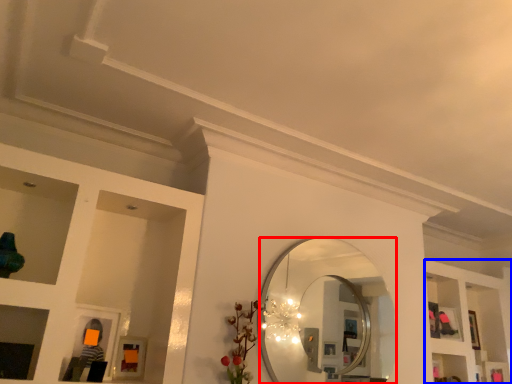
Question: Which object appears farthest to the camera in this image, mirror (highlighted by a red box) or shelf (highlighted by a blue box)?

Choices:
 (A) mirror
 (B) shelf

Answer: (B)